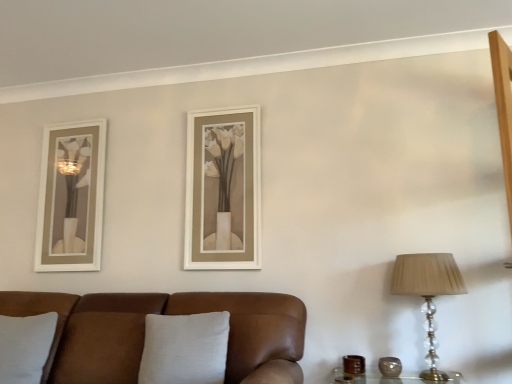
Question: From the image's perspective, relative to translucent crystal table lamp at right, is white linen pillow at center, positioned as the 1th pillow in right-to-left order, above or below?

Choices:
 (A) below
 (B) above

Answer: (A)

Question: Based on their sizes in the image, would you say white linen pillow at center, the 2th pillow when ordered from left to right, is bigger or smaller than translucent crystal table lamp at right?

Choices:
 (A) big
 (B) small

Answer: (B)

Question: Which object is positioned closest to the brown leather couch at lower left?

Choices:
 (A) gray fabric pillow at lower left, marked as the 1th pillow in a left-to-right arrangement
 (B) brown leather candle holder at lower right, positioned as the 2th candle holder in right-to-left order
 (C) white linen pillow at center, the 2th pillow when ordered from left to right
 (D) translucent crystal table lamp at right
 (E) brown textured vase at right, the second candle holder in the left-to-right sequence

Answer: (C)

Question: Which of these objects is positioned farthest from the brown leather couch at lower left?

Choices:
 (A) brown leather candle holder at lower right, positioned as the 2th candle holder in right-to-left order
 (B) translucent crystal table lamp at right
 (C) brown textured vase at right, the second candle holder in the left-to-right sequence
 (D) gray fabric pillow at lower left, marked as the 1th pillow in a left-to-right arrangement
 (E) white linen pillow at center, positioned as the 1th pillow in right-to-left order

Answer: (C)